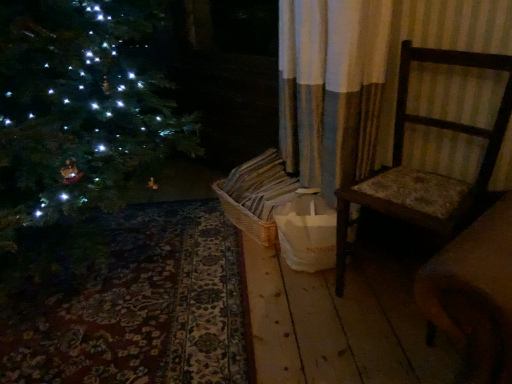
The width and height of the screenshot is (512, 384). What do you see at coordinates (422, 170) in the screenshot? I see `wooden chair with floral cushion at right` at bounding box center [422, 170].

Where is `wooden chair with floral cushion at right`? wooden chair with floral cushion at right is located at coordinates (422, 170).

The image size is (512, 384). Find the location of `wooden chair with floral cushion at right`. wooden chair with floral cushion at right is located at coordinates (422, 170).